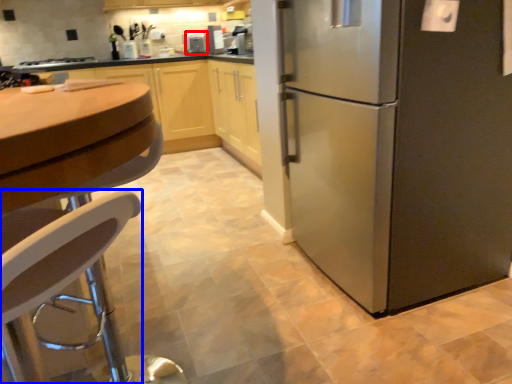
Question: Which of the following is the closest to the observer, appliance (highlighted by a red box) or chair (highlighted by a blue box)?

Choices:
 (A) appliance
 (B) chair

Answer: (B)